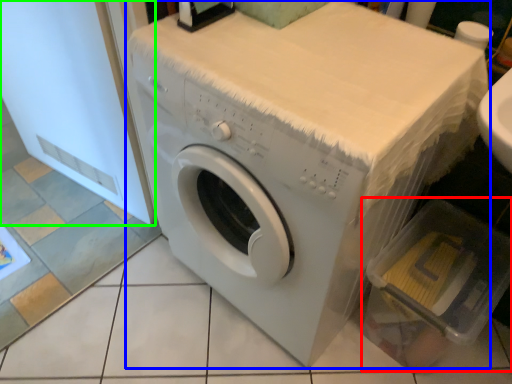
Question: Estimate the real-world distances between objects in this image. Which object is farther from dish washer (highlighted by a red box), washing machine (highlighted by a blue box) or screen door (highlighted by a green box)?

Choices:
 (A) washing machine
 (B) screen door

Answer: (B)